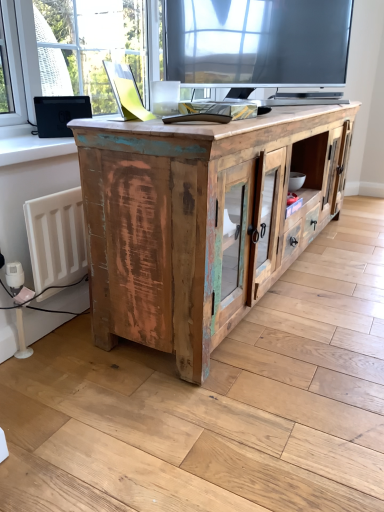
What do you see at coordinates (201, 221) in the screenshot?
I see `rustic wood cabinet at center` at bounding box center [201, 221].

What is the approximate width of rustic wood cabinet at center?

It is 43.30 centimeters.

The width and height of the screenshot is (384, 512). What are the coordinates of `rustic wood cabinet at center` in the screenshot? It's located at (201, 221).

In the scene shown: What is the approximate height of rustic wood cabinet at center?

rustic wood cabinet at center is 25.79 inches tall.

What is the approximate width of white painted wood at left?

The width of white painted wood at left is 10.48 inches.

Describe the element at coordinates (30, 145) in the screenshot. I see `white painted wood at left` at that location.

Locate an element on the screen. The width and height of the screenshot is (384, 512). white painted wood at left is located at coordinates (30, 145).

Image resolution: width=384 pixels, height=512 pixels. I want to click on rustic wood cabinet at center, so click(x=201, y=221).

Does white painted wood at left appear on the right side of rustic wood cabinet at center?

No.

Considering the positions of objects white painted wood at left and rustic wood cabinet at center in the image provided, who is in front, white painted wood at left or rustic wood cabinet at center?

rustic wood cabinet at center is in front.

Does point (10, 152) lie in front of point (158, 203)?

That is False.

Based on the photo, from the image's perspective, would you say white painted wood at left is shown under rustic wood cabinet at center?

No.

From a real-world perspective, does white painted wood at left stand above rustic wood cabinet at center?

Yes.

Between white painted wood at left and rustic wood cabinet at center, which one has larger width?

With larger width is rustic wood cabinet at center.

Between white painted wood at left and rustic wood cabinet at center, which one has less height?

white painted wood at left.

Who is bigger, white painted wood at left or rustic wood cabinet at center?

rustic wood cabinet at center.

Could rustic wood cabinet at center be considered to be inside white painted wood at left?

No.

Is the surface of white painted wood at left in direct contact with rustic wood cabinet at center?

white painted wood at left is not next to rustic wood cabinet at center, and they're not touching.

Is white painted wood at left oriented away from rustic wood cabinet at center?

No.

Find the location of a particular element. The image size is (384, 512). cabinetry on the right of the white painted wood at left is located at coordinates point(201,221).

Does rustic wood cabinet at center appear on the left side of white painted wood at left?

In fact, rustic wood cabinet at center is to the right of white painted wood at left.

Is rustic wood cabinet at center positioned behind white painted wood at left?

No, rustic wood cabinet at center is closer to the viewer.

Is point (338, 178) closer to camera compared to point (33, 139)?

No, (338, 178) is further to viewer.

From the picture: From the image's perspective, is rustic wood cabinet at center located above white painted wood at left?

No, from the image's perspective, rustic wood cabinet at center is not over white painted wood at left.

From a real-world perspective, is rustic wood cabinet at center physically located above or below white painted wood at left?

From a real-world perspective, rustic wood cabinet at center is physically below white painted wood at left.

Considering the sizes of rustic wood cabinet at center and white painted wood at left in the image, is rustic wood cabinet at center wider or thinner than white painted wood at left?

Considering their sizes, rustic wood cabinet at center looks broader than white painted wood at left.

Is rustic wood cabinet at center taller or shorter than white painted wood at left?

rustic wood cabinet at center is taller than white painted wood at left.

Considering the relative sizes of rustic wood cabinet at center and white painted wood at left in the image provided, is rustic wood cabinet at center smaller than white painted wood at left?

A: No.

In the scene shown: Does rustic wood cabinet at center contain white painted wood at left?

Actually, white painted wood at left is outside rustic wood cabinet at center.

Is rustic wood cabinet at center not near white painted wood at left?

No, rustic wood cabinet at center is not far from white painted wood at left.

From the picture: Does rustic wood cabinet at center turn towards white painted wood at left?

No, rustic wood cabinet at center is not aimed at white painted wood at left.

Measure the distance from rustic wood cabinet at center to white painted wood at left.

rustic wood cabinet at center and white painted wood at left are 23.05 inches apart from each other.

This screenshot has width=384, height=512. Identify the location of window sill behind the rustic wood cabinet at center. (30, 145).

This screenshot has height=512, width=384. Find the location of `cabinetry on the right of white painted wood at left`. cabinetry on the right of white painted wood at left is located at coordinates (201, 221).

You are a GUI agent. You are given a task and a screenshot of the screen. Output one action in this format:
    pyautogui.click(x=<x>, y=<y>)
    Task: Click on the window sill positioned vertically above the rustic wood cabinet at center (from a real-world perspective)
    
    Given the screenshot: What is the action you would take?
    pyautogui.click(x=30, y=145)